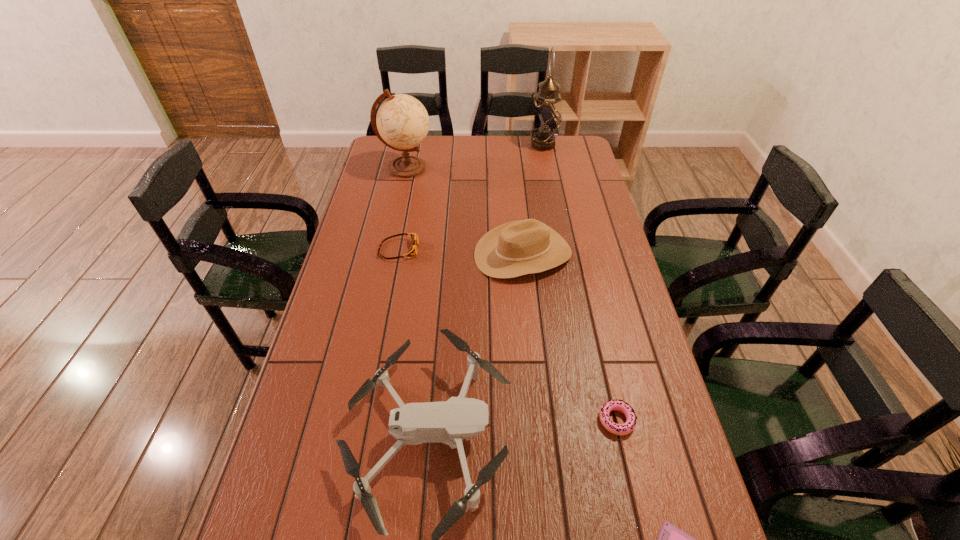
Where is `vacant space located 0.320m on the back of the sixth tallest object`? This screenshot has width=960, height=540. vacant space located 0.320m on the back of the sixth tallest object is located at coordinates (590, 306).

Find the location of a particular element. oil lamp positioned at the far edge is located at coordinates (546, 118).

You are a GUI agent. You are given a task and a screenshot of the screen. Output one action in this format:
    pyautogui.click(x=<x>, y=<y>)
    Task: Click on the globe positioned at the far edge
    Image resolution: width=960 pixels, height=540 pixels.
    Given the screenshot: What is the action you would take?
    pyautogui.click(x=402, y=121)

Locate an element on the screen. globe that is at the left edge is located at coordinates (402, 121).

I want to click on goggles that is at the left edge, so click(x=412, y=251).

Find the location of `oil lamp that is at the right edge`. oil lamp that is at the right edge is located at coordinates (546, 118).

Locate an element on the screen. cowboy hat at the right edge is located at coordinates (521, 247).

Where is `doughnut located at the right edge`? The image size is (960, 540). doughnut located at the right edge is located at coordinates (619, 405).

Where is `object positioned at the far left corner`? The height and width of the screenshot is (540, 960). object positioned at the far left corner is located at coordinates (402, 121).

Identify the location of object that is at the far right corner. The image size is (960, 540). (546, 118).